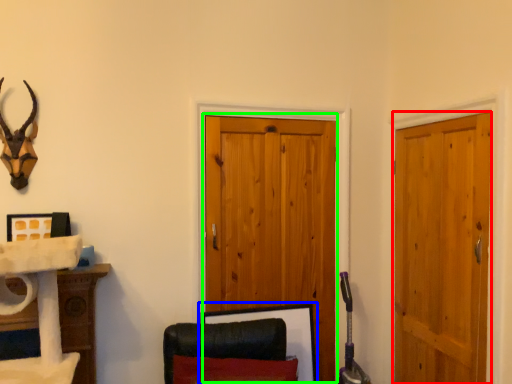
Question: Which object is positioned closest to door (highlighted by a red box)? Select from picture frame (highlighted by a blue box) and barn door (highlighted by a green box).

Choices:
 (A) picture frame
 (B) barn door

Answer: (B)